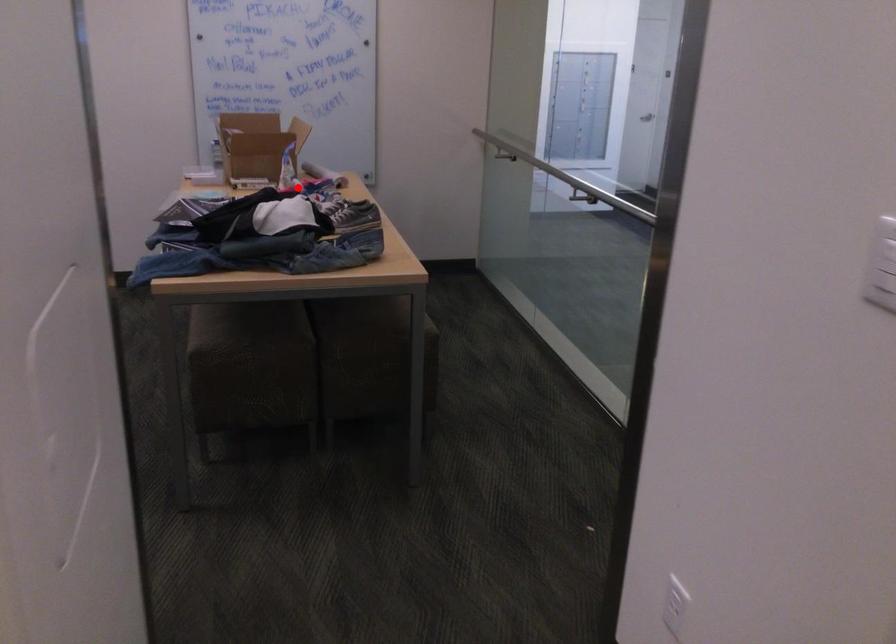
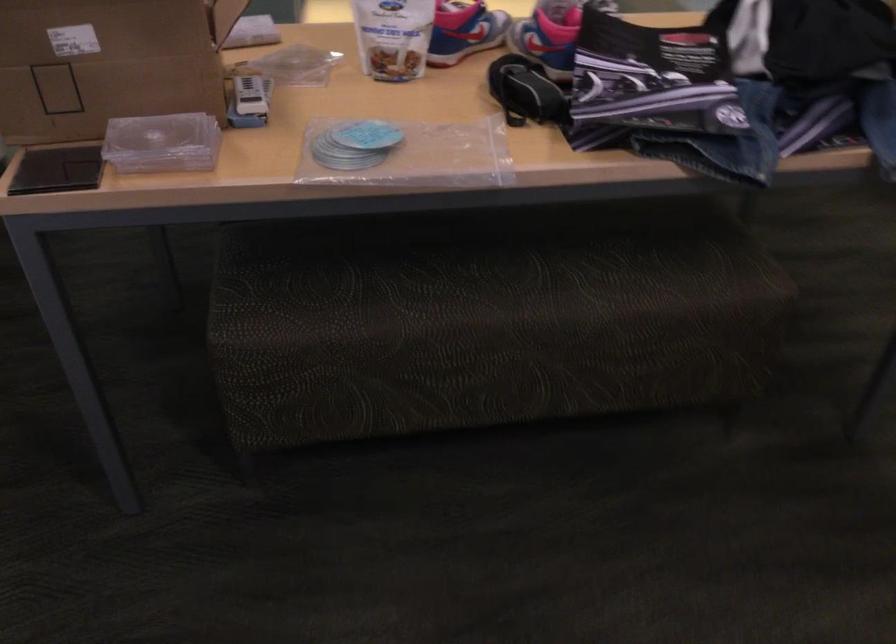
Question: I am providing you with two images of the same scene from different viewpoints. A red point is shown in image1. For the corresponding object point in image2, is it positioned nearer or farther from the camera?

Choices:
 (A) Nearer
 (B) Farther

Answer: (A)